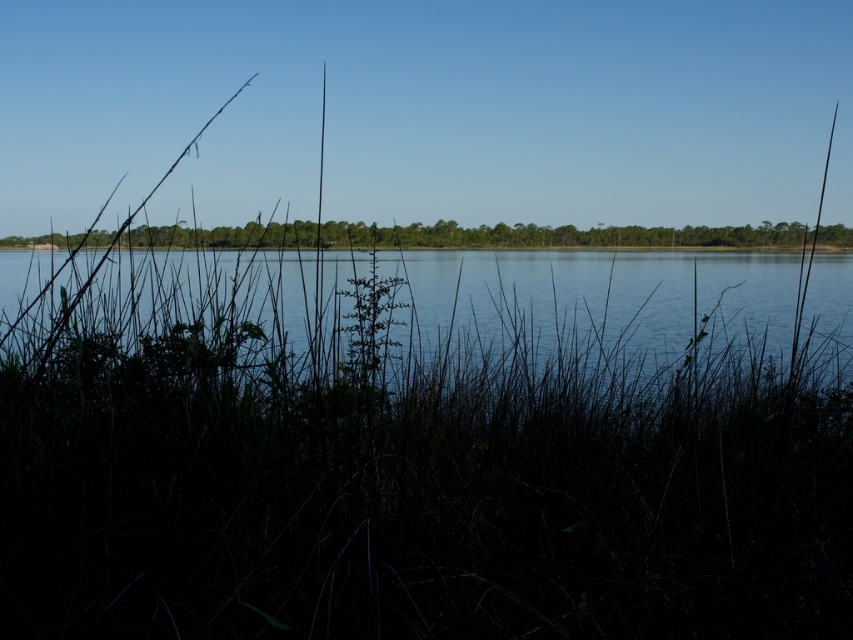
Find the location of a particular element. The height and width of the screenshot is (640, 853). green matte grass at center is located at coordinates (431, 452).

I want to click on green matte grass at center, so click(431, 452).

Identify the location of green matte grass at center. (431, 452).

Can you confirm if green matte grass at center is bigger than green leafy plant at center?

Indeed, green matte grass at center has a larger size compared to green leafy plant at center.

Does green matte grass at center have a greater width compared to green leafy plant at center?

Correct, the width of green matte grass at center exceeds that of green leafy plant at center.

This screenshot has width=853, height=640. Find the location of `green matte grass at center`. green matte grass at center is located at coordinates (431, 452).

The image size is (853, 640). What do you see at coordinates (593, 298) in the screenshot?
I see `clear water at center` at bounding box center [593, 298].

Can you confirm if clear water at center is shorter than green leafy plant at center?

Correct, clear water at center is not as tall as green leafy plant at center.

Describe the element at coordinates (593, 298) in the screenshot. I see `clear water at center` at that location.

What are the coordinates of `clear water at center` in the screenshot? It's located at 593,298.